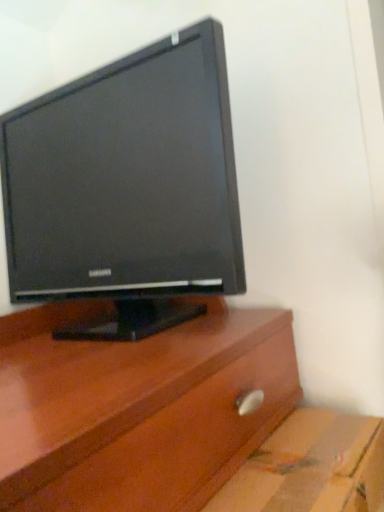
Question: Is the position of black glossy monitor at upper center more distant than that of cardboard at lower right?

Choices:
 (A) yes
 (B) no

Answer: (A)

Question: From a real-world perspective, does black glossy monitor at upper center sit lower than cardboard at lower right?

Choices:
 (A) yes
 (B) no

Answer: (B)

Question: Does black glossy monitor at upper center contain cardboard at lower right?

Choices:
 (A) yes
 (B) no

Answer: (B)

Question: Is black glossy monitor at upper center positioned before cardboard at lower right?

Choices:
 (A) yes
 (B) no

Answer: (B)

Question: Is black glossy monitor at upper center turned away from cardboard at lower right?

Choices:
 (A) no
 (B) yes

Answer: (A)

Question: From a real-world perspective, is black glossy monitor at upper center on top of cardboard at lower right?

Choices:
 (A) no
 (B) yes

Answer: (B)

Question: Does cardboard at lower right lie behind black glossy monitor at upper center?

Choices:
 (A) no
 (B) yes

Answer: (A)

Question: Is cardboard at lower right smaller than black glossy monitor at upper center?

Choices:
 (A) no
 (B) yes

Answer: (B)

Question: Does cardboard at lower right have a lesser width compared to black glossy monitor at upper center?

Choices:
 (A) no
 (B) yes

Answer: (B)

Question: Can you confirm if cardboard at lower right is taller than black glossy monitor at upper center?

Choices:
 (A) yes
 (B) no

Answer: (B)

Question: Is cardboard at lower right outside of black glossy monitor at upper center?

Choices:
 (A) yes
 (B) no

Answer: (A)

Question: Can you confirm if cardboard at lower right is positioned to the left of black glossy monitor at upper center?

Choices:
 (A) yes
 (B) no

Answer: (B)

Question: In the image, is cardboard at lower right positioned in front of or behind black glossy monitor at upper center?

Choices:
 (A) behind
 (B) front

Answer: (B)